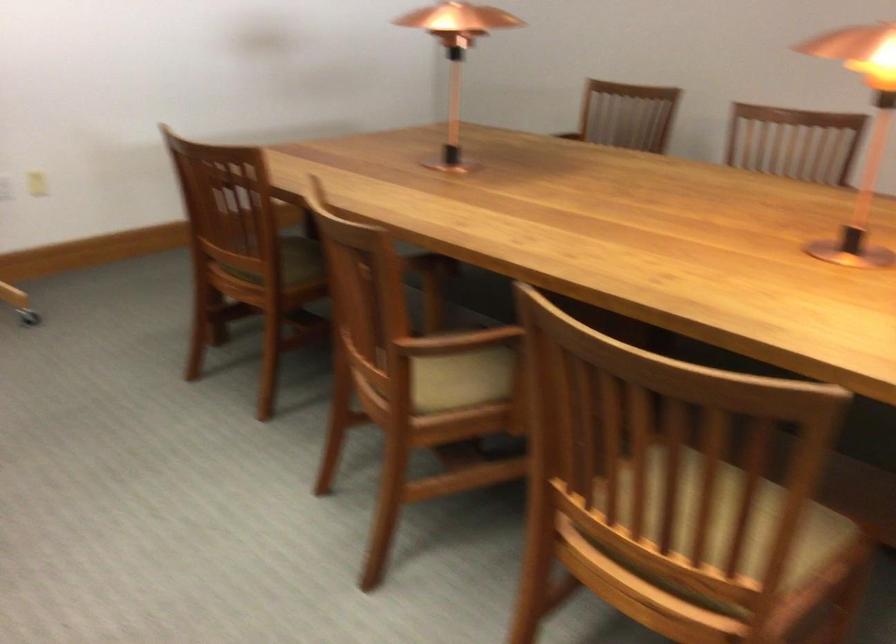
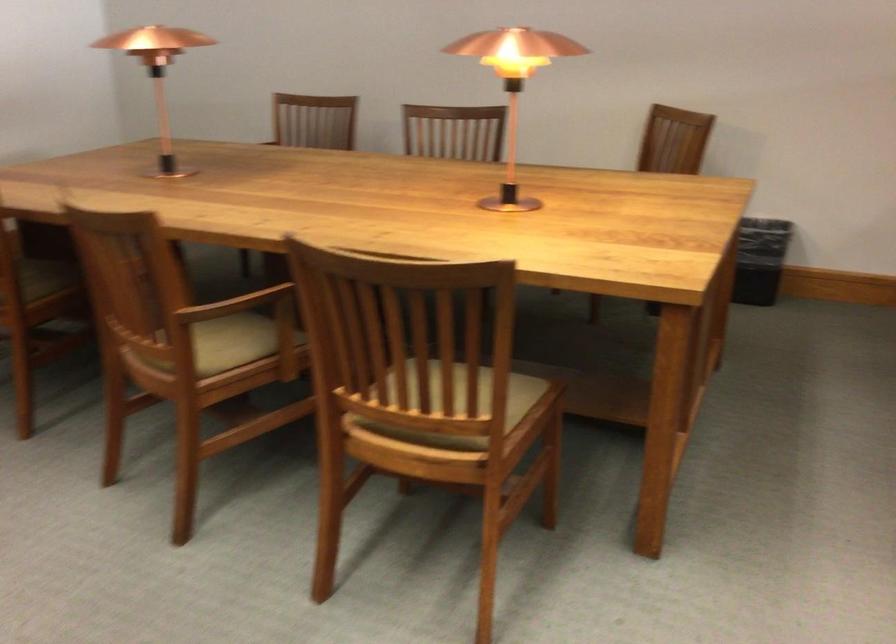
Locate, in the second image, the point that corresponds to point 306,263 in the first image.

(44, 279)